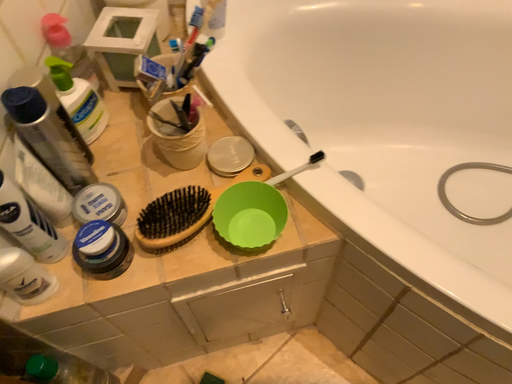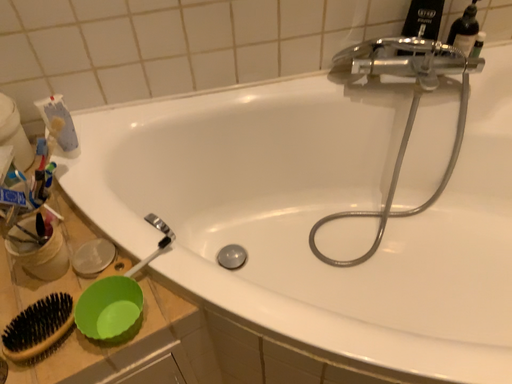
Question: Which way did the camera rotate in the video?

Choices:
 (A) rotated downward
 (B) rotated upward

Answer: (B)